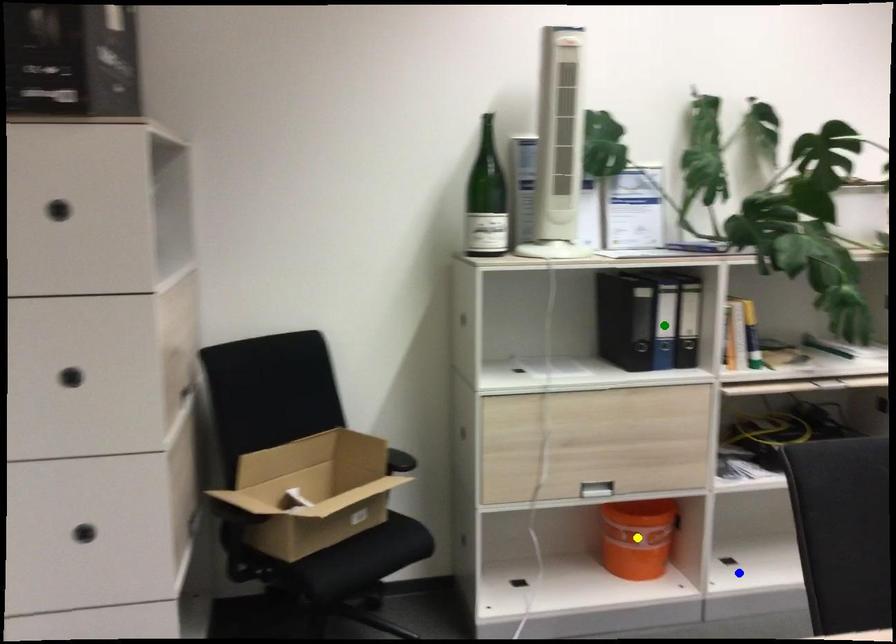
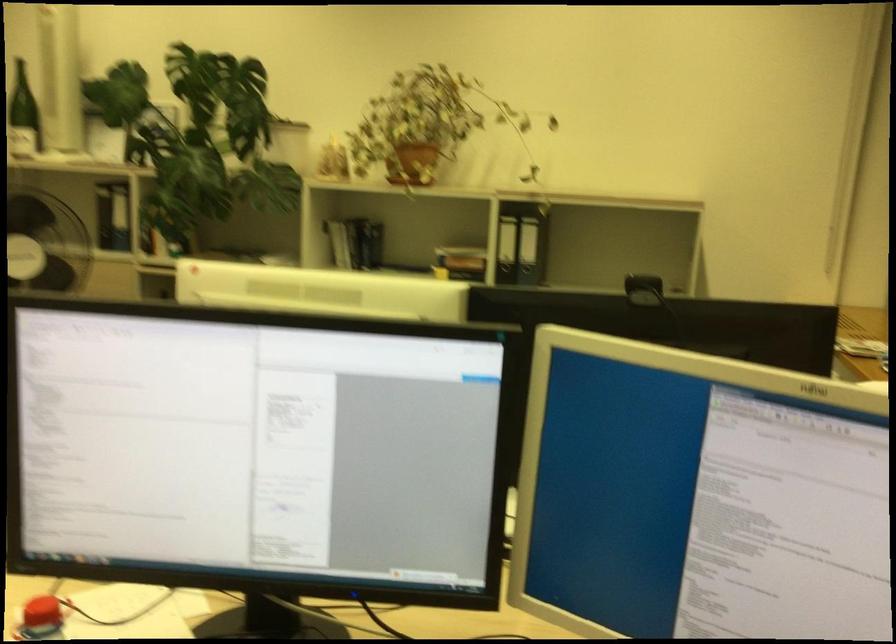
I am providing you with two images of the same scene from different viewpoints. Three points are marked in image1. Which point corresponds to a part or object that is occluded in image2?In image1, three points are marked. Which of them correspond to a part or object that is occluded in image2?Among the three points shown in image1, which one corresponds to a part or object that is no longer visible due to occlusion in image2?

green point, blue point, yellow point